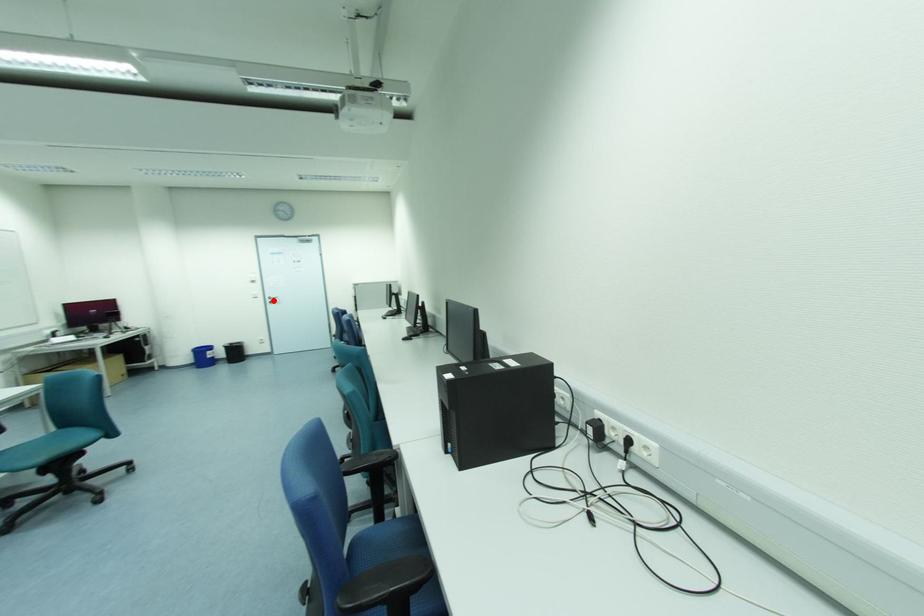
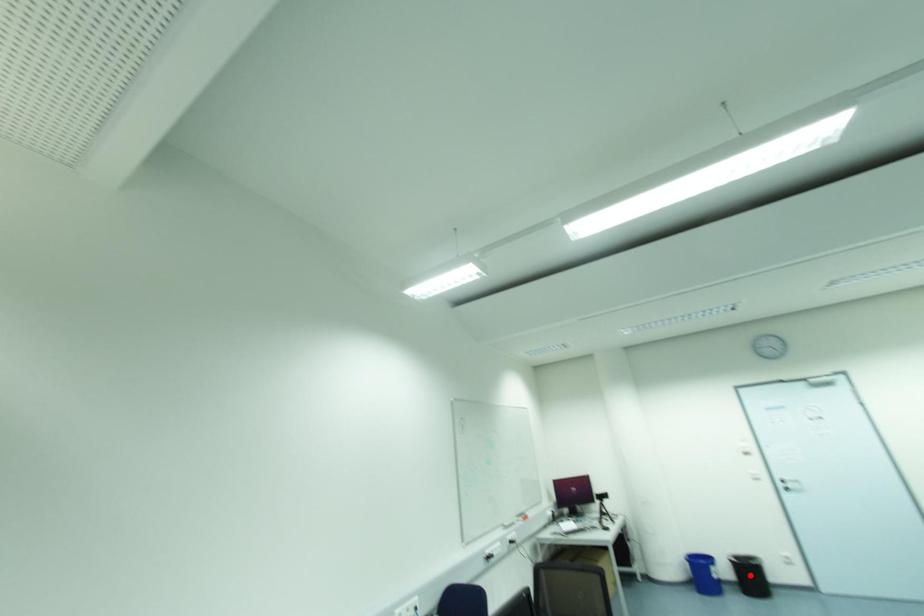
I am providing you with two images of the same scene from different viewpoints. A red point is marked on the first image and another point is marked on the second image. Are the points marked in image1 and image2 representing the same 3D position?

No